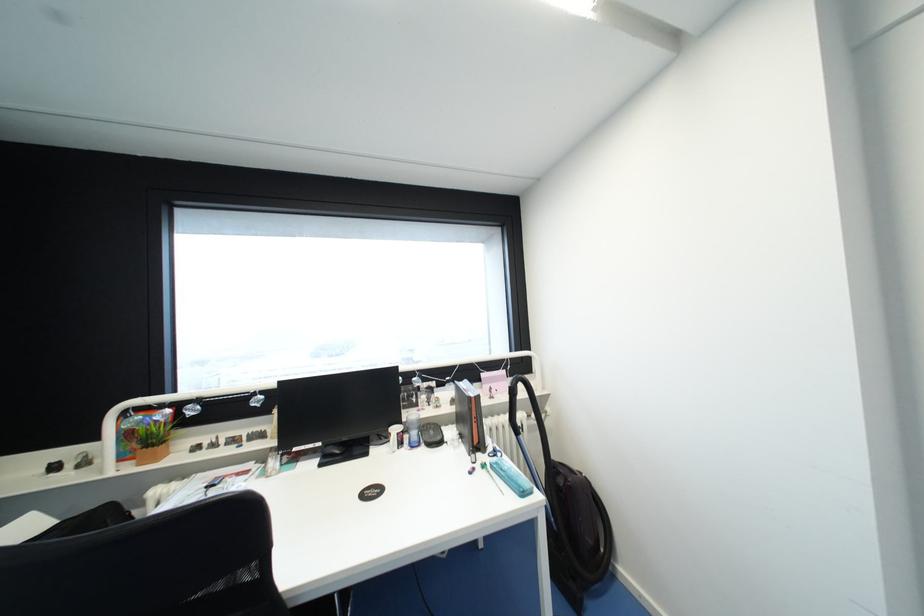
The image size is (924, 616). Find the location of `vacuum cleaner handle`. vacuum cleaner handle is located at coordinates (523, 403).